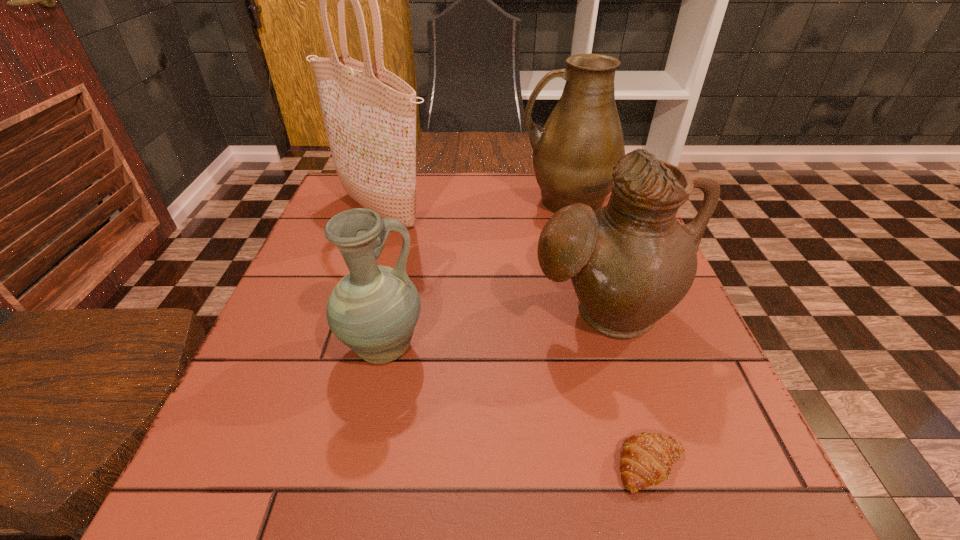
The width and height of the screenshot is (960, 540). In order to click on object located at the near right corner in this screenshot , I will do `click(646, 459)`.

Find the location of a particular element. The height and width of the screenshot is (540, 960). vacant area at the far edge of the desktop is located at coordinates (472, 172).

Locate an element on the screen. The height and width of the screenshot is (540, 960). vacant region at the near edge is located at coordinates (516, 515).

What are the coordinates of `vacant space at the left edge of the desktop` in the screenshot? It's located at (326, 239).

What are the coordinates of `vacant point located between the farthest pitcher and the tallest object` in the screenshot? It's located at 474,207.

The height and width of the screenshot is (540, 960). I want to click on free space between the shopping bag and the crescent roll, so click(516, 339).

This screenshot has height=540, width=960. In order to click on free point between the tallest object and the crescent roll in this screenshot , I will do pyautogui.click(x=516, y=339).

Where is `free space between the farthest pitcher and the shopping bag`? Image resolution: width=960 pixels, height=540 pixels. free space between the farthest pitcher and the shopping bag is located at coordinates (474, 207).

Find the location of a particular element. The height and width of the screenshot is (540, 960). empty space that is in between the second shortest object and the crescent roll is located at coordinates (517, 407).

Choose which object is the second nearest neighbor to the nearest object. Please provide its 2D coordinates. Your answer should be formatted as a tuple, i.e. [(x, y)], where the tuple contains the x and y coordinates of a point satisfying the conditions above.

[(373, 310)]